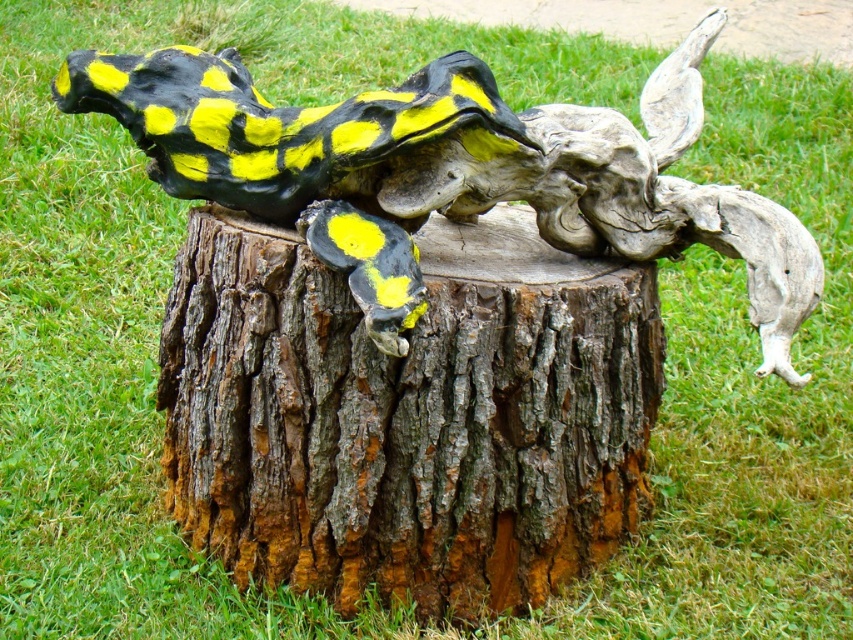
Find the location of a particular element. This screenshot has height=640, width=853. rough bark tree stump at center is located at coordinates (408, 413).

Is point (428, 508) positioned behind point (310, 144)?

Yes, it is.

Is point (265, 321) more distant than point (666, 161)?

No, it is in front of (666, 161).

At what (x,y) coordinates should I click in order to perform the action: click on rough bark tree stump at center. Please return your answer as a coordinate pair (x, y). Looking at the image, I should click on (408, 413).